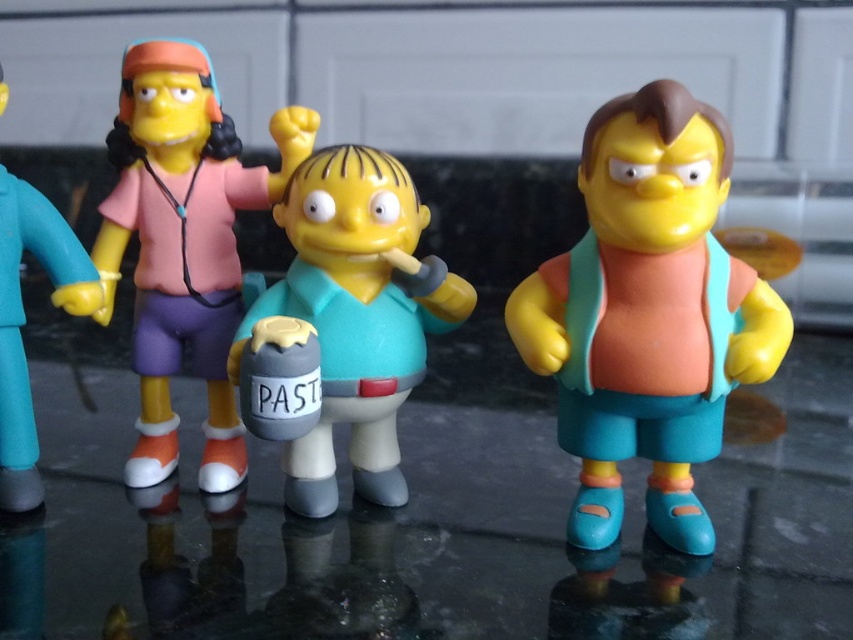
Question: Can you confirm if matte orange shirt at center is positioned above teal plastic figure at left?

Choices:
 (A) no
 (B) yes

Answer: (A)

Question: Which point appears closest to the camera in this image?

Choices:
 (A) (283, 371)
 (B) (682, 483)
 (C) (22, 312)

Answer: (A)

Question: Which of these objects is positioned farthest from the matte plastic figure at center?

Choices:
 (A) matte plastic boy at center
 (B) matte orange shirt at center
 (C) gray matte pastel at center

Answer: (B)

Question: Estimate the real-world distances between objects in this image. Which object is closer to the gray matte pastel at center?

Choices:
 (A) matte plastic boy at center
 (B) teal plastic figure at left
 (C) matte plastic figure at center

Answer: (A)

Question: Can you confirm if matte plastic boy at center is positioned below teal plastic figure at left?

Choices:
 (A) no
 (B) yes

Answer: (B)

Question: Is matte orange shirt at center bigger than matte plastic figure at center?

Choices:
 (A) yes
 (B) no

Answer: (A)